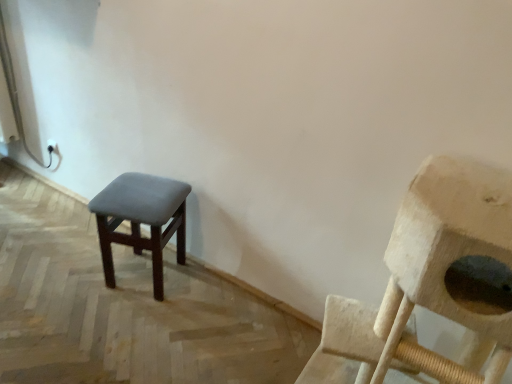
Question: Could you tell me if dark gray fabric stool at left is turned towards wooden cat tree at right?

Choices:
 (A) no
 (B) yes

Answer: (A)

Question: From the image's perspective, is dark gray fabric stool at left on wooden cat tree at right?

Choices:
 (A) no
 (B) yes

Answer: (B)

Question: Is dark gray fabric stool at left positioned in front of wooden cat tree at right?

Choices:
 (A) yes
 (B) no

Answer: (B)

Question: Is the depth of dark gray fabric stool at left greater than that of wooden cat tree at right?

Choices:
 (A) no
 (B) yes

Answer: (B)

Question: Is dark gray fabric stool at left surrounding wooden cat tree at right?

Choices:
 (A) yes
 (B) no

Answer: (B)

Question: Is dark gray fabric stool at left thinner than wooden cat tree at right?

Choices:
 (A) yes
 (B) no

Answer: (A)

Question: Does wooden cat tree at right appear on the right side of dark gray fabric stool at left?

Choices:
 (A) yes
 (B) no

Answer: (A)

Question: Can you confirm if wooden cat tree at right is taller than dark gray fabric stool at left?

Choices:
 (A) no
 (B) yes

Answer: (B)

Question: Is wooden cat tree at right surrounding dark gray fabric stool at left?

Choices:
 (A) no
 (B) yes

Answer: (A)

Question: Does wooden cat tree at right turn towards dark gray fabric stool at left?

Choices:
 (A) yes
 (B) no

Answer: (B)

Question: Considering the relative sizes of wooden cat tree at right and dark gray fabric stool at left in the image provided, is wooden cat tree at right bigger than dark gray fabric stool at left?

Choices:
 (A) yes
 (B) no

Answer: (A)

Question: Is wooden cat tree at right completely or partially outside of dark gray fabric stool at left?

Choices:
 (A) no
 (B) yes

Answer: (B)

Question: Considering the positions of wooden cat tree at right and dark gray fabric stool at left in the image, is wooden cat tree at right wider or thinner than dark gray fabric stool at left?

Choices:
 (A) wide
 (B) thin

Answer: (A)